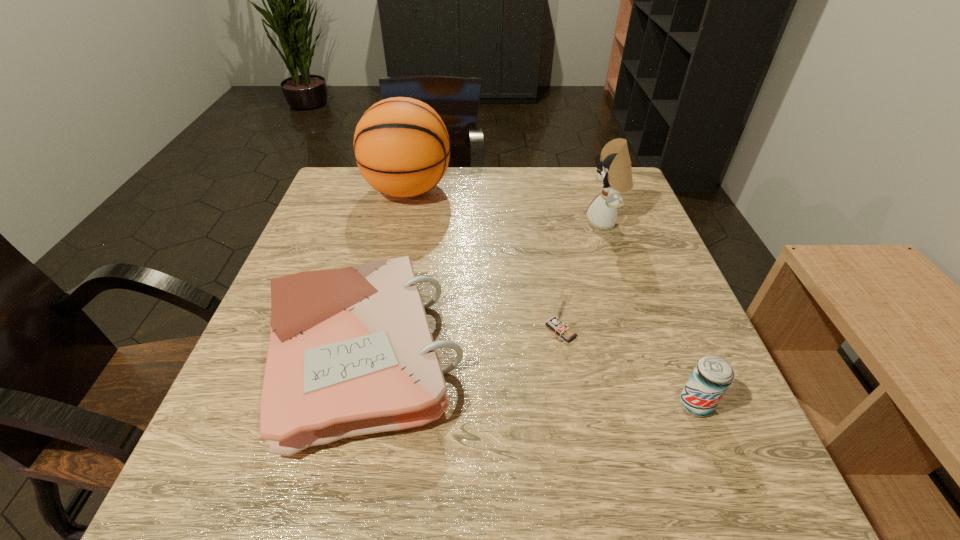
What are the coordinates of `basketball` in the screenshot? It's located at (401, 145).

The width and height of the screenshot is (960, 540). I want to click on doll, so [x=614, y=169].

Find the location of a particular element. This screenshot has width=960, height=540. the third object from right to left is located at coordinates (556, 323).

The height and width of the screenshot is (540, 960). Find the location of `beer can`. beer can is located at coordinates (712, 376).

At what (x,y) coordinates should I click in order to perform the action: click on phonebook. Please return your answer as a coordinate pair (x, y). Looking at the image, I should click on (351, 352).

You are a GUI agent. You are given a task and a screenshot of the screen. Output one action in this format:
    pyautogui.click(x=<x>, y=<y>)
    Task: Click on the free space located 0.250m on the front of the basketball
    This screenshot has width=960, height=540.
    Given the screenshot: What is the action you would take?
    pyautogui.click(x=388, y=283)

Where is `free location located 0.350m at the front face of the doll`? This screenshot has width=960, height=540. free location located 0.350m at the front face of the doll is located at coordinates (448, 222).

Find the location of `free region located 0.340m at the front face of the doll`. free region located 0.340m at the front face of the doll is located at coordinates (452, 222).

Image resolution: width=960 pixels, height=540 pixels. I want to click on vacant space situated 0.150m at the front face of the doll, so click(x=527, y=222).

Where is `free space located on the back of the third object from right to left`? free space located on the back of the third object from right to left is located at coordinates (546, 252).